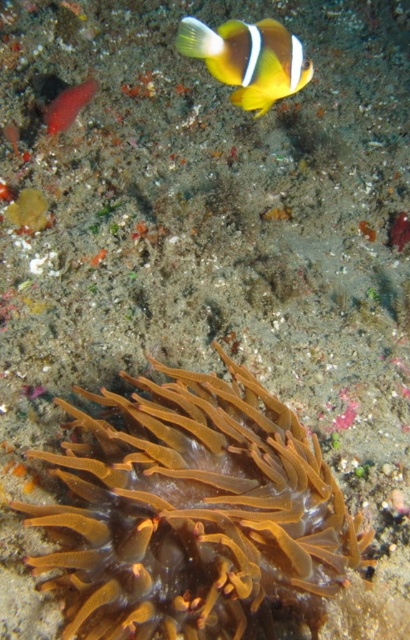
Question: Which of the following is the farthest from the observer?

Choices:
 (A) (246, 92)
 (B) (59, 129)

Answer: (B)

Question: Can you confirm if orange translucent anemone at bottom is smaller than yellow matte clownfish at upper center?

Choices:
 (A) yes
 (B) no

Answer: (B)

Question: Which object is closer to the camera taking this photo?

Choices:
 (A) orange translucent anemone at bottom
 (B) smooth pinkish coral at upper left

Answer: (A)

Question: Does orange translucent anemone at bottom have a greater width compared to yellow matte clownfish at upper center?

Choices:
 (A) no
 (B) yes

Answer: (B)

Question: Can you confirm if orange translucent anemone at bottom is positioned to the right of yellow matte clownfish at upper center?

Choices:
 (A) yes
 (B) no

Answer: (B)

Question: Which point is closer to the camera?

Choices:
 (A) (220, 540)
 (B) (302, 77)
 (C) (52, 120)

Answer: (A)